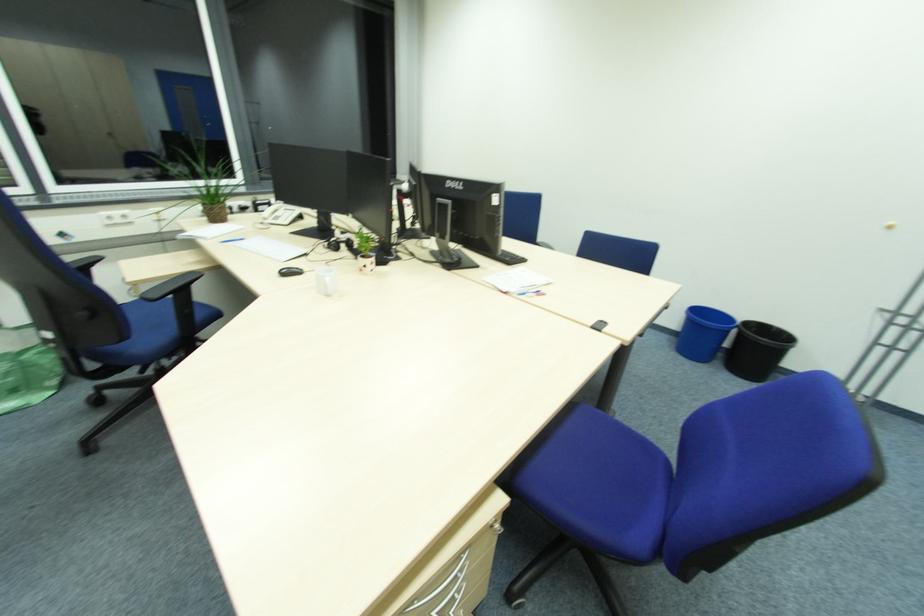
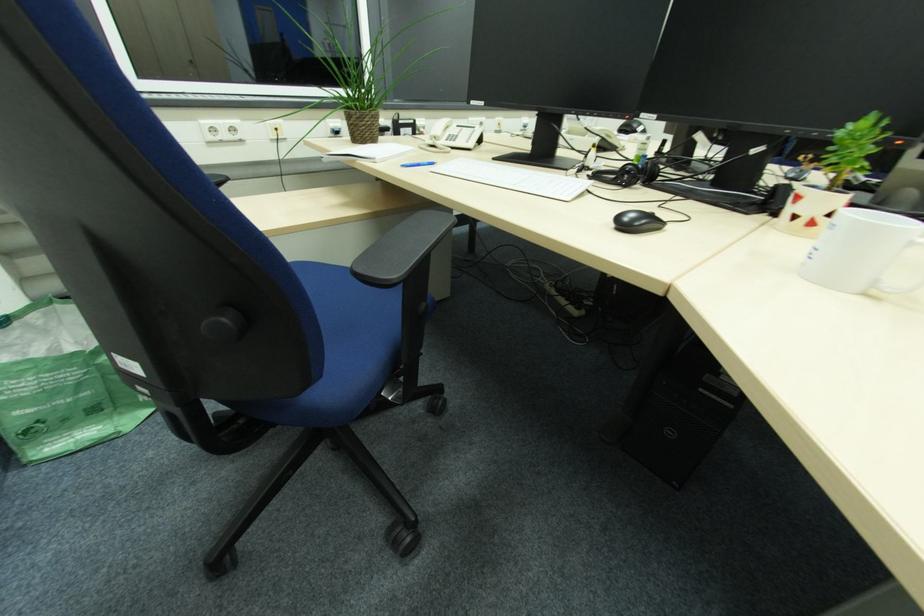
The images are taken continuously from a first-person perspective. In which direction are you moving?

The cameraman moved toward left, forward.